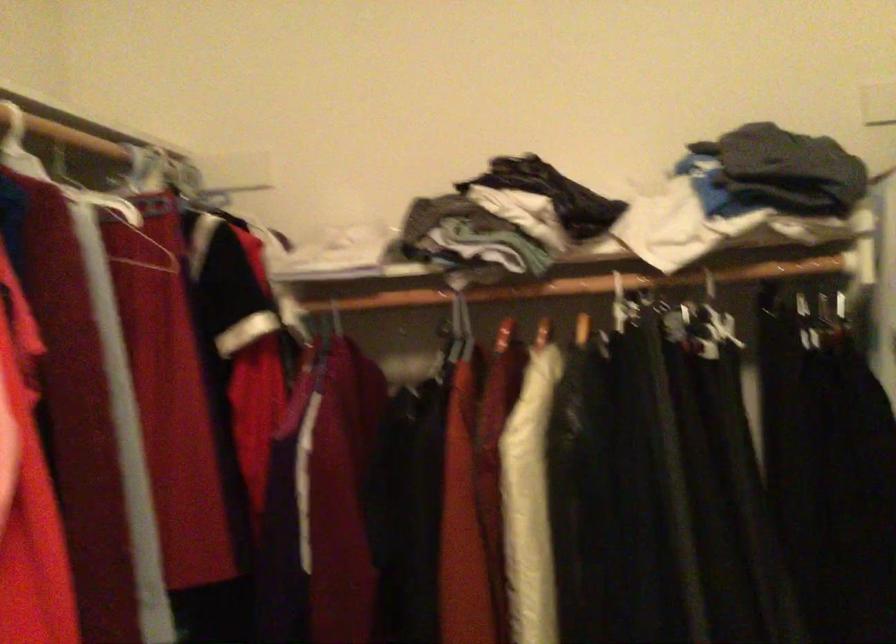
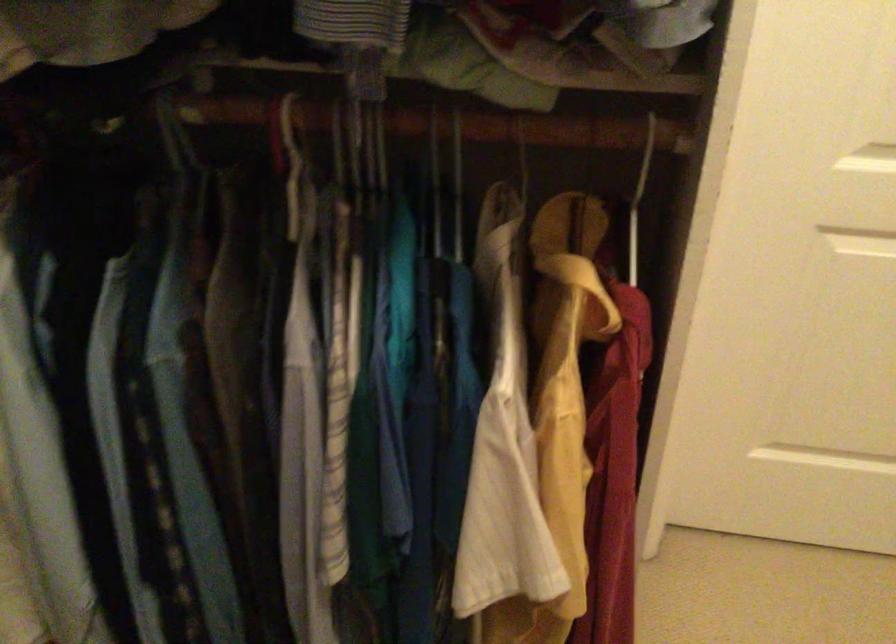
Based on the continuous images, in which direction is the camera rotating?

The rotation direction of the camera is right-down.